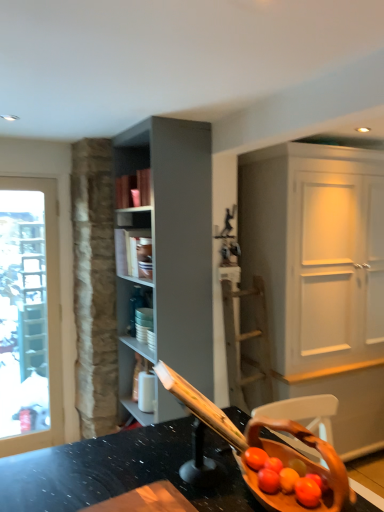
Question: Is matte gray shelf at center to the left of white matte cabinet at right from the viewer's perspective?

Choices:
 (A) yes
 (B) no

Answer: (A)

Question: Does matte gray shelf at center have a smaller size compared to white matte cabinet at right?

Choices:
 (A) yes
 (B) no

Answer: (A)

Question: From a real-world perspective, is matte gray shelf at center over white matte cabinet at right?

Choices:
 (A) no
 (B) yes

Answer: (B)

Question: Could you tell me if matte gray shelf at center is facing white matte cabinet at right?

Choices:
 (A) no
 (B) yes

Answer: (A)

Question: Is matte gray shelf at center further to camera compared to white matte cabinet at right?

Choices:
 (A) yes
 (B) no

Answer: (A)

Question: From a real-world perspective, does matte gray shelf at center sit lower than white matte cabinet at right?

Choices:
 (A) no
 (B) yes

Answer: (A)

Question: Would you consider white matte cabinet at right to be distant from matte gray shelf at center?

Choices:
 (A) yes
 (B) no

Answer: (A)

Question: Is white matte cabinet at right outside of matte gray shelf at center?

Choices:
 (A) no
 (B) yes

Answer: (B)

Question: From the image's perspective, would you say white matte cabinet at right is positioned over matte gray shelf at center?

Choices:
 (A) yes
 (B) no

Answer: (B)

Question: Does white matte cabinet at right appear on the right side of matte gray shelf at center?

Choices:
 (A) yes
 (B) no

Answer: (A)

Question: From a real-world perspective, does white matte cabinet at right stand above matte gray shelf at center?

Choices:
 (A) yes
 (B) no

Answer: (B)

Question: Considering the relative sizes of white matte cabinet at right and matte gray shelf at center in the image provided, is white matte cabinet at right bigger than matte gray shelf at center?

Choices:
 (A) yes
 (B) no

Answer: (A)

Question: In the image, is white matte cabinet at right positioned in front of or behind matte gray shelf at center?

Choices:
 (A) behind
 (B) front

Answer: (B)